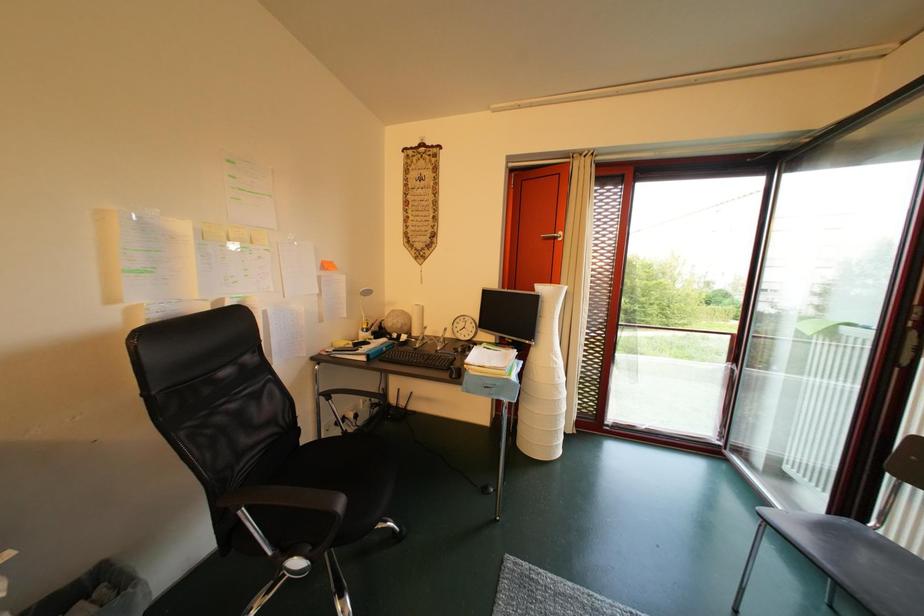
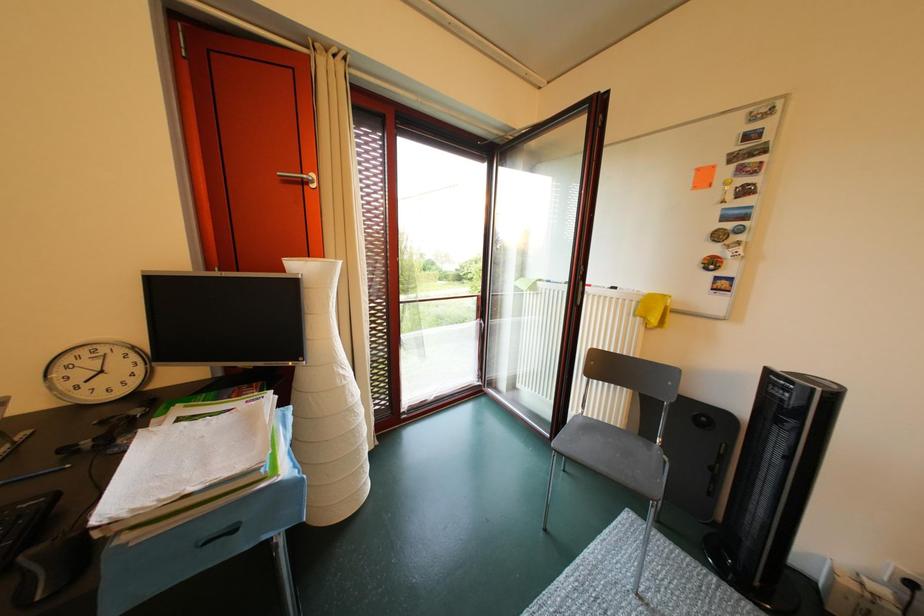
Question: The first image is from the beginning of the video and the second image is from the end. How did the camera likely rotate when shooting the video?

Choices:
 (A) Left
 (B) Right
 (C) Up
 (D) Down

Answer: (B)